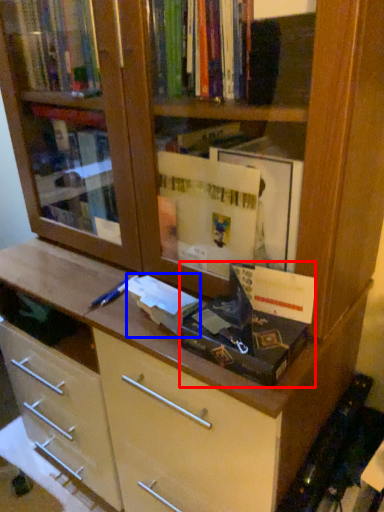
Question: Which point is further to the camera, paperback book (highlighted by a red box) or paperback book (highlighted by a blue box)?

Choices:
 (A) paperback book
 (B) paperback book

Answer: (B)